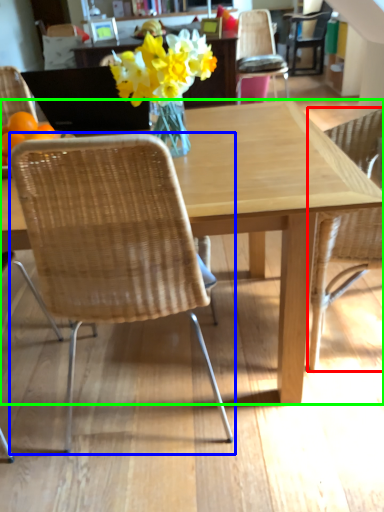
Question: Based on their relative distances, which object is nearer to chair (highlighted by a red box)? Choose from chair (highlighted by a blue box) and kitchen & dining room table (highlighted by a green box).

Choices:
 (A) chair
 (B) kitchen & dining room table

Answer: (B)